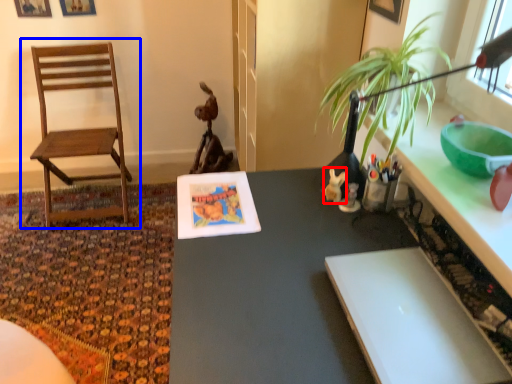
Question: Among these objects, which one is farthest to the camera, toy (highlighted by a red box) or chair (highlighted by a blue box)?

Choices:
 (A) toy
 (B) chair

Answer: (B)